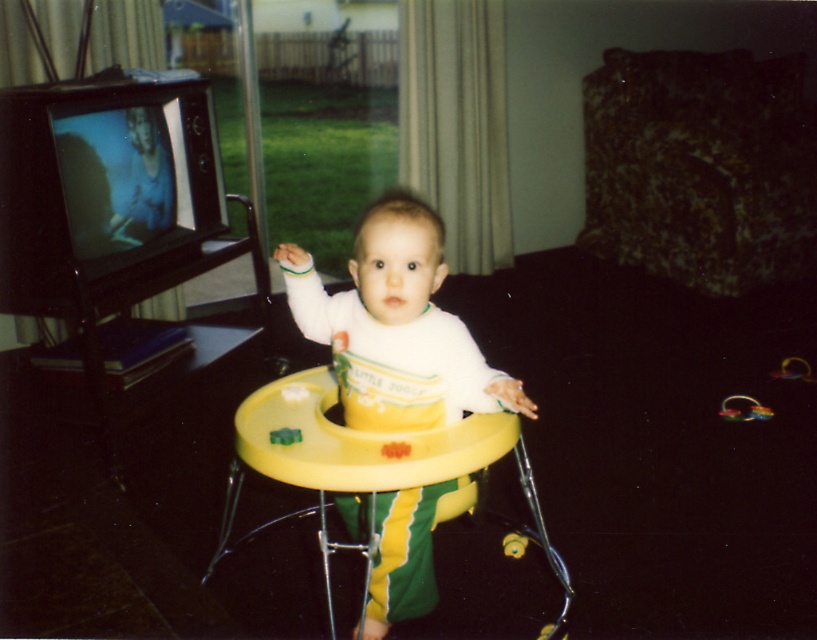
Question: Is white matte walker at center below rubberized plastic toy at center?

Choices:
 (A) yes
 (B) no

Answer: (B)

Question: Which object is the farthest from the translucent plastic ring at lower right?

Choices:
 (A) green plastic walker at center
 (B) white matte walker at center

Answer: (A)

Question: Can you confirm if translucent plastic ring at lower right is thinner than green plastic walker at center?

Choices:
 (A) no
 (B) yes

Answer: (A)

Question: Is rubberized plastic toy at center positioned at the back of green plastic walker at center?

Choices:
 (A) yes
 (B) no

Answer: (A)

Question: Which object is positioned farthest from the green plastic walker at center?

Choices:
 (A) rubberized plastic toy at center
 (B) translucent plastic ring at lower right
 (C) white matte walker at center

Answer: (B)

Question: Which point is farther to the camera?

Choices:
 (A) translucent plastic ring at lower right
 (B) rubberized plastic toy at center

Answer: (A)